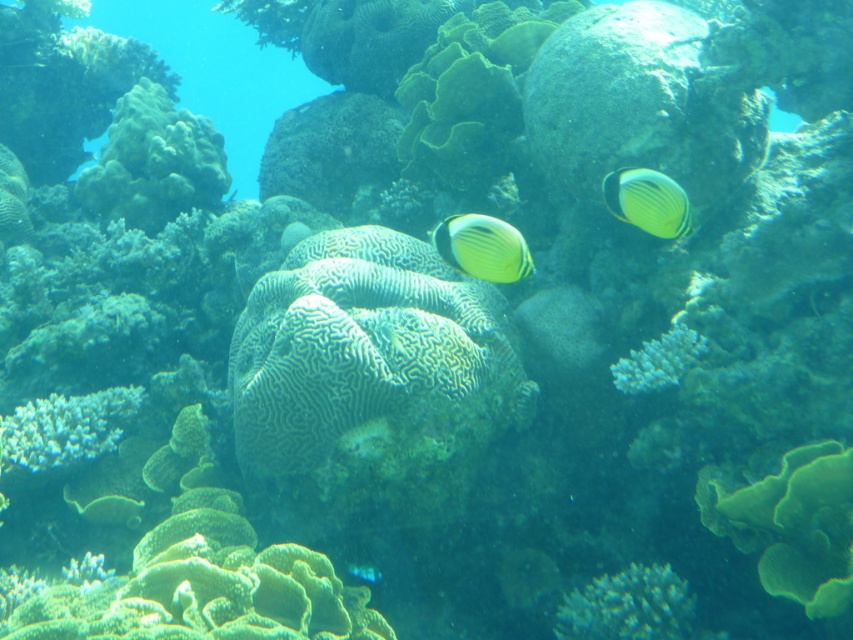
Question: Is yellow matte butterflyfish at center positioned before yellow matte butterflyfish at upper right?

Choices:
 (A) yes
 (B) no

Answer: (A)

Question: Considering the real-world distances, which object is closest to the yellow matte butterflyfish at upper right?

Choices:
 (A) yellow matte butterflyfish at center
 (B) white coral at lower center
 (C) white coral at center
 (D) translucent blue fish at lower center

Answer: (A)

Question: Which point is farther from the camera taking this photo?

Choices:
 (A) (439, 225)
 (B) (672, 593)
 (C) (660, 204)
 (D) (619, 376)

Answer: (A)

Question: Which of these objects is positioned farthest from the yellow matte butterflyfish at upper right?

Choices:
 (A) white coral at lower center
 (B) yellow matte butterflyfish at center
 (C) translucent blue fish at lower center

Answer: (C)

Question: Does yellow matte butterflyfish at center have a larger size compared to translucent blue fish at lower center?

Choices:
 (A) no
 (B) yes

Answer: (B)

Question: In this image, where is yellow matte butterflyfish at upper right located relative to translucent blue fish at lower center?

Choices:
 (A) below
 (B) above

Answer: (B)